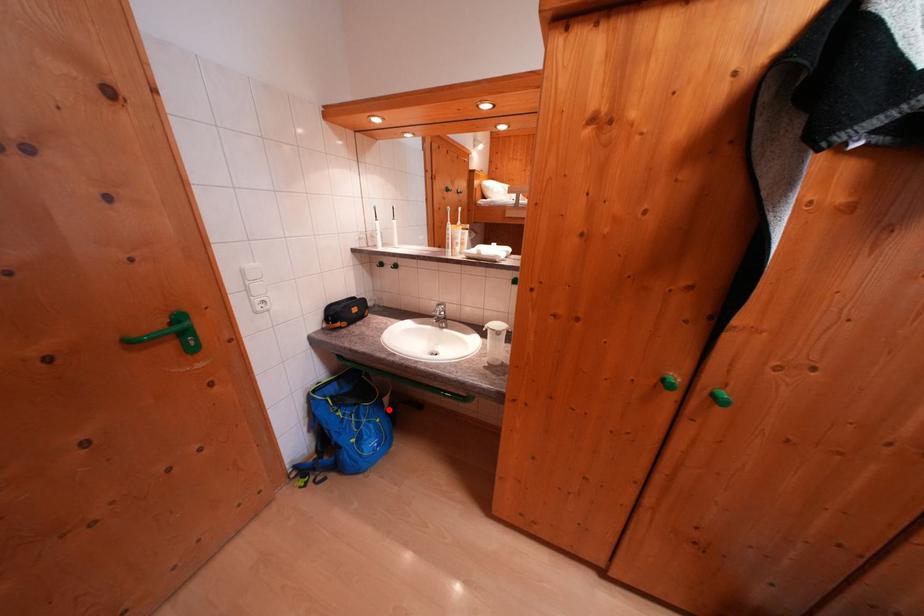
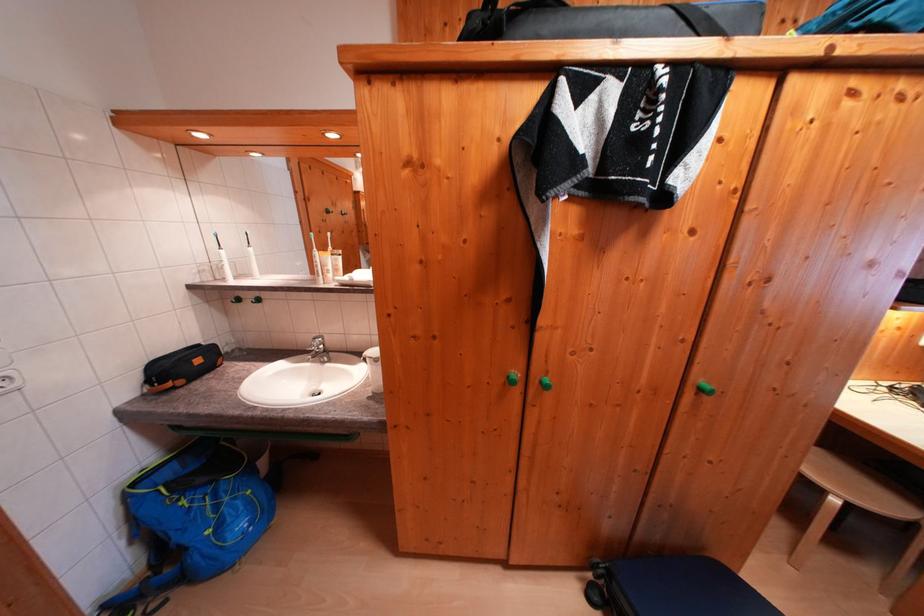
Locate, in the second image, the point that corresponds to the highlighted location in the first image.

(262, 476)